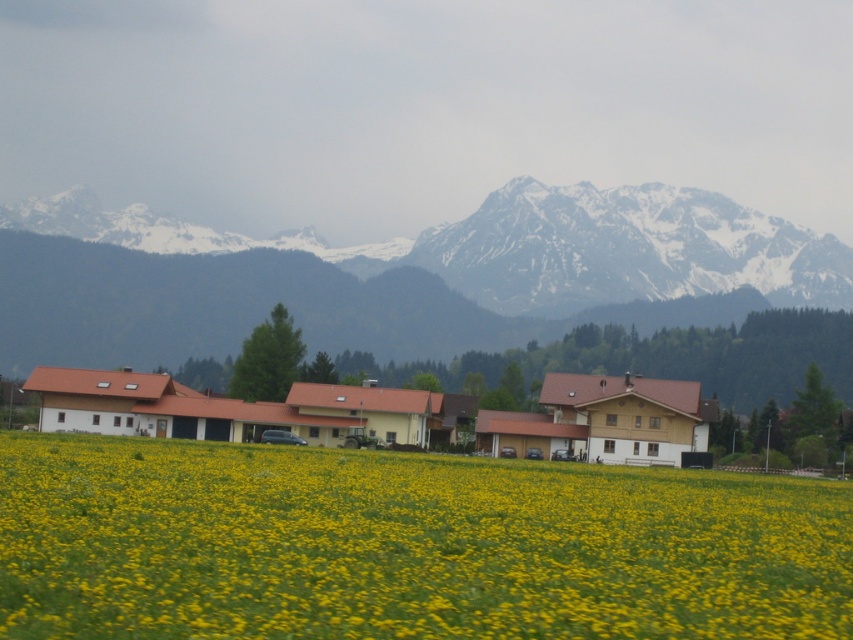
Does point (625, 627) lie behind point (163, 246)?

No, it is in front of (163, 246).

Is yellow grass at center below snowy rock mountain range at upper center?

Correct, yellow grass at center is located below snowy rock mountain range at upper center.

Is point (267, 502) behind point (277, 250)?

That is False.

I want to click on yellow grass at center, so click(405, 545).